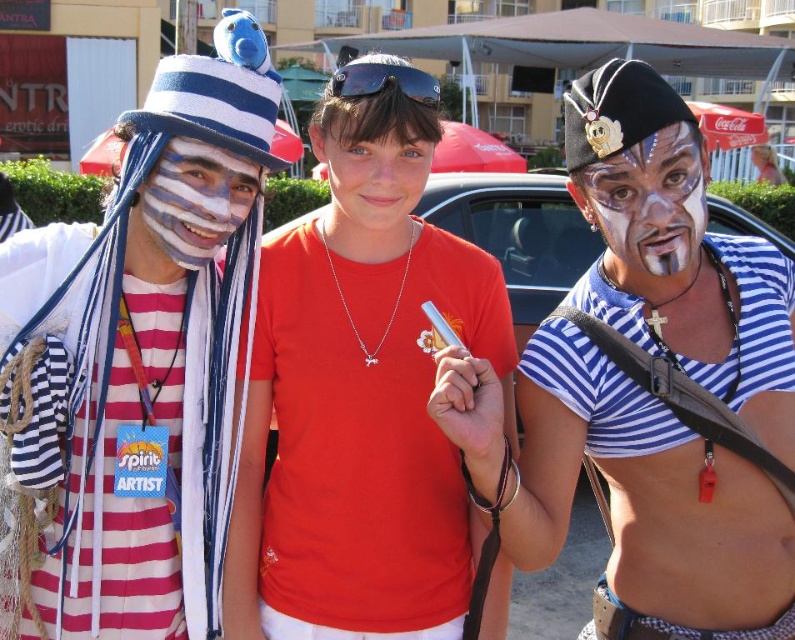
Looking at this image, can you confirm if striped fabric sailor hat at left is smaller than red matte shirt at center?

Incorrect, striped fabric sailor hat at left is not smaller in size than red matte shirt at center.

Is point (99, 237) positioned after point (390, 394)?

No.

This screenshot has width=795, height=640. Find the location of `striped fabric sailor hat at left`. striped fabric sailor hat at left is located at coordinates (136, 364).

Can you confirm if matte striped face at center is positioned to the left of black rubber goggles at center?

Correct, you'll find matte striped face at center to the left of black rubber goggles at center.

Between point (181, 253) and point (421, 93), which one is positioned in front?

Point (181, 253) is in front.

Locate an element on the screen. The width and height of the screenshot is (795, 640). matte striped face at center is located at coordinates (188, 209).

Is striped fabric sailor hat at left thinner than matte striped face at center?

No, striped fabric sailor hat at left is not thinner than matte striped face at center.

Is striped fabric sailor hat at left below matte striped face at center?

Correct, striped fabric sailor hat at left is located below matte striped face at center.

Is point (60, 468) less distant than point (206, 152)?

No, (60, 468) is further to viewer.

Where is `striped fabric sailor hat at left`? The height and width of the screenshot is (640, 795). striped fabric sailor hat at left is located at coordinates (136, 364).